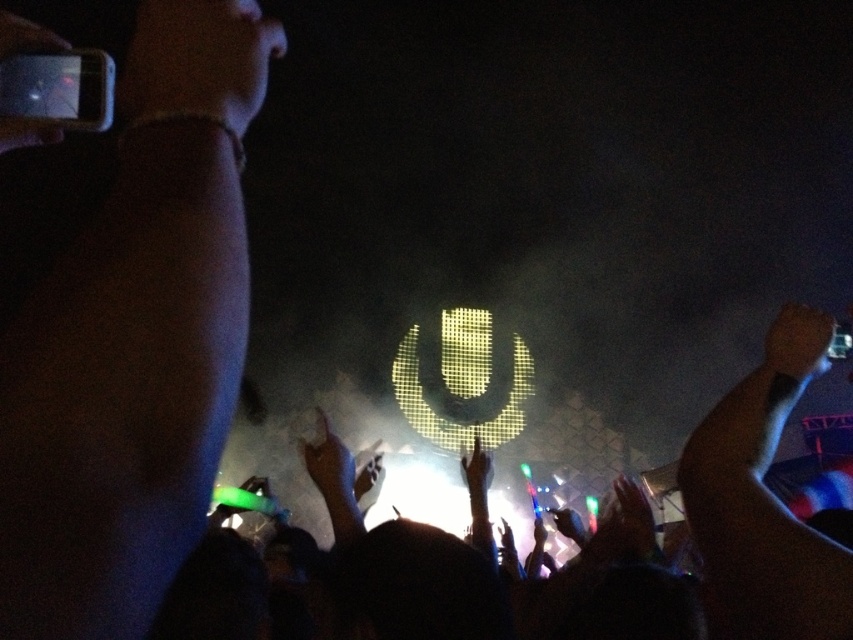
Question: Can you confirm if matte black hand at upper right is positioned to the right of black matte phone at upper left?

Choices:
 (A) no
 (B) yes

Answer: (B)

Question: Which point appears closest to the camera in this image?

Choices:
 (A) pyautogui.click(x=769, y=337)
 (B) pyautogui.click(x=33, y=131)

Answer: (B)

Question: Which point appears closest to the camera in this image?

Choices:
 (A) (32, 35)
 (B) (810, 340)

Answer: (A)

Question: Can you confirm if matte black hand at upper right is positioned above black matte phone at upper left?

Choices:
 (A) no
 (B) yes

Answer: (A)

Question: Does matte black hand at upper right appear under black matte phone at upper left?

Choices:
 (A) yes
 (B) no

Answer: (A)

Question: Among these points, which one is farthest from the camera?

Choices:
 (A) (796, 339)
 (B) (22, 120)

Answer: (A)